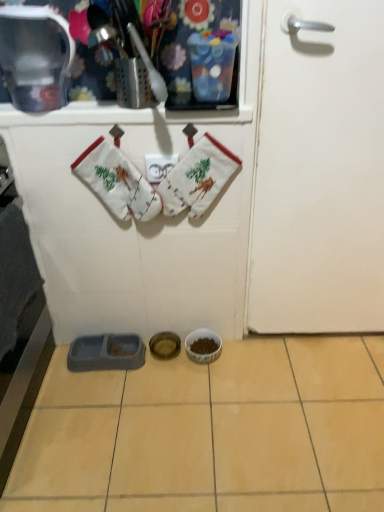
Locate an element on the screen. This screenshot has height=512, width=384. free space in front of white matte door at right is located at coordinates (323, 398).